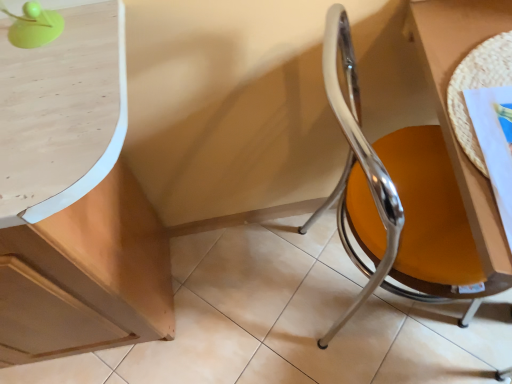
You are a GUI agent. You are given a task and a screenshot of the screen. Output one action in this format:
    pyautogui.click(x=<x>, y=<y>)
    Task: Click on the vacant space in front of green plastic ball at upper left
    
    Given the screenshot: What is the action you would take?
    pyautogui.click(x=48, y=102)